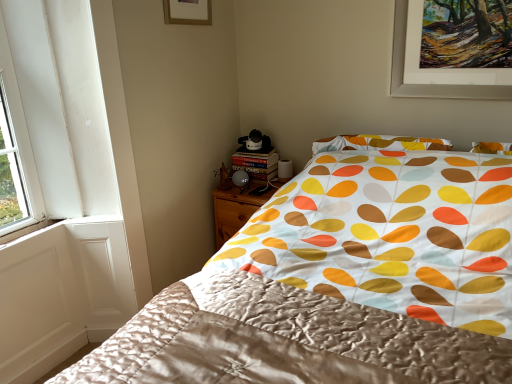
The image size is (512, 384). Find the location of `wooden nightstand at lower center`. wooden nightstand at lower center is located at coordinates (238, 208).

The width and height of the screenshot is (512, 384). What do you see at coordinates (341, 283) in the screenshot?
I see `silky fabric bed at center` at bounding box center [341, 283].

Find the location of a particular element. The image size is (512, 384). wooden nightstand at lower center is located at coordinates (238, 208).

Looking at this image, from a real-world perspective, is matte gold picture frame at upper center beneath silky fabric bed at center?

No, from a real-world perspective, matte gold picture frame at upper center is not beneath silky fabric bed at center.

Is matte gold picture frame at upper center facing towards silky fabric bed at center?

No, matte gold picture frame at upper center is not oriented towards silky fabric bed at center.

How distant is matte gold picture frame at upper center from silky fabric bed at center?

A distance of 1.35 meters exists between matte gold picture frame at upper center and silky fabric bed at center.

Which object is positioned more to the right, matte gold picture frame at upper center or silky fabric bed at center?

From the viewer's perspective, silky fabric bed at center appears more on the right side.

Is silky fabric bed at center with silky satin blanket at center?

There is a gap between silky fabric bed at center and silky satin blanket at center.

Is silky fabric bed at center spatially inside silky satin blanket at center, or outside of it?

silky fabric bed at center is outside silky satin blanket at center.

In terms of width, does silky fabric bed at center look wider or thinner when compared to silky satin blanket at center?

Clearly, silky fabric bed at center has more width compared to silky satin blanket at center.

Could you tell me if silky fabric bed at center is facing silky satin blanket at center?

Yes.

Is point (223, 248) positioned in front of point (210, 5)?

Yes, it is.

Considering the sizes of objects silky fabric bed at center and matte gold picture frame at upper center in the image provided, who is smaller, silky fabric bed at center or matte gold picture frame at upper center?

matte gold picture frame at upper center.

Which of these two, silky fabric bed at center or matte gold picture frame at upper center, stands shorter?

matte gold picture frame at upper center.

Is silky fabric bed at center not near matte gold picture frame at upper center?

Yes, silky fabric bed at center is far from matte gold picture frame at upper center.

Does wooden nightstand at lower center have a smaller size compared to silky satin blanket at center?

Yes, wooden nightstand at lower center is smaller than silky satin blanket at center.

Is wooden nightstand at lower center to the left of silky satin blanket at center from the viewer's perspective?

Yes, wooden nightstand at lower center is to the left of silky satin blanket at center.

This screenshot has height=384, width=512. In the image, there is a silky satin blanket at center. What are the coordinates of `nightstand above it (from the image's perspective)` in the screenshot? It's located at (238, 208).

Is wooden nightstand at lower center not within silky satin blanket at center?

Yes, wooden nightstand at lower center is not within silky satin blanket at center.

What's the angular difference between wooden nightstand at lower center and matte gold picture frame at upper center's facing directions?

wooden nightstand at lower center and matte gold picture frame at upper center are facing 89.8 degrees away from each other.

From the image's perspective, who appears lower, wooden nightstand at lower center or matte gold picture frame at upper center?

wooden nightstand at lower center.

Can you confirm if wooden nightstand at lower center is smaller than matte gold picture frame at upper center?

No.

Is silky fabric bed at center next to wooden nightstand at lower center?

There is a gap between silky fabric bed at center and wooden nightstand at lower center.

Between silky fabric bed at center and wooden nightstand at lower center, which one is positioned in front?

silky fabric bed at center is closer to the camera.

Considering the sizes of silky fabric bed at center and wooden nightstand at lower center in the image, is silky fabric bed at center wider or thinner than wooden nightstand at lower center?

silky fabric bed at center is wider than wooden nightstand at lower center.

From a real-world perspective, between silky fabric bed at center and wooden nightstand at lower center, who is vertically lower?

wooden nightstand at lower center, from a real-world perspective.

Is wooden nightstand at lower center smaller than silky fabric bed at center?

Yes.

Choose the correct answer: Is wooden nightstand at lower center inside silky fabric bed at center or outside it?

wooden nightstand at lower center is outside silky fabric bed at center.

I want to click on bed in front of the wooden nightstand at lower center, so click(341, 283).

Identify the location of picture frame located above the silky fabric bed at center (from the image's perspective). (187, 12).

This screenshot has height=384, width=512. Find the location of `blanket below the silky fabric bed at center (from a real-world perspective)`. blanket below the silky fabric bed at center (from a real-world perspective) is located at coordinates (283, 340).

Based on their spatial positions, is matte gold picture frame at upper center or silky fabric bed at center closer to silky satin blanket at center?

silky fabric bed at center is positioned closer to the anchor silky satin blanket at center.

Looking at the image, which one is located further to silky fabric bed at center, wooden nightstand at lower center or matte gold picture frame at upper center?

matte gold picture frame at upper center lies further to silky fabric bed at center than the other object.

From the image, which object appears to be farther from wooden nightstand at lower center, silky fabric bed at center or silky satin blanket at center?

silky satin blanket at center is further to wooden nightstand at lower center.

Looking at the image, which one is located closer to matte gold picture frame at upper center, silky satin blanket at center or silky fabric bed at center?

silky fabric bed at center.

Which object lies nearer to the anchor point matte gold picture frame at upper center, silky satin blanket at center or wooden nightstand at lower center?

wooden nightstand at lower center is positioned closer to the anchor matte gold picture frame at upper center.

Estimate the real-world distances between objects in this image. Which object is further from silky satin blanket at center, matte gold picture frame at upper center or wooden nightstand at lower center?

matte gold picture frame at upper center lies further to silky satin blanket at center than the other object.

Which object lies nearer to the anchor point silky satin blanket at center, silky fabric bed at center or matte gold picture frame at upper center?

silky fabric bed at center lies closer to silky satin blanket at center than the other object.

When comparing their distances from matte gold picture frame at upper center, does silky fabric bed at center or wooden nightstand at lower center seem further?

The object further to matte gold picture frame at upper center is silky fabric bed at center.

Where is `blanket located between silky fabric bed at center and wooden nightstand at lower center in the depth direction`? blanket located between silky fabric bed at center and wooden nightstand at lower center in the depth direction is located at coordinates (283, 340).

This screenshot has height=384, width=512. I want to click on picture frame between silky fabric bed at center and wooden nightstand at lower center from front to back, so click(x=187, y=12).

At what (x,y) coordinates should I click in order to perform the action: click on bed between matte gold picture frame at upper center and silky satin blanket at center vertically. Please return your answer as a coordinate pair (x, y). This screenshot has width=512, height=384. Looking at the image, I should click on (341, 283).

I want to click on picture frame between silky satin blanket at center and wooden nightstand at lower center in the front-back direction, so tap(187, 12).